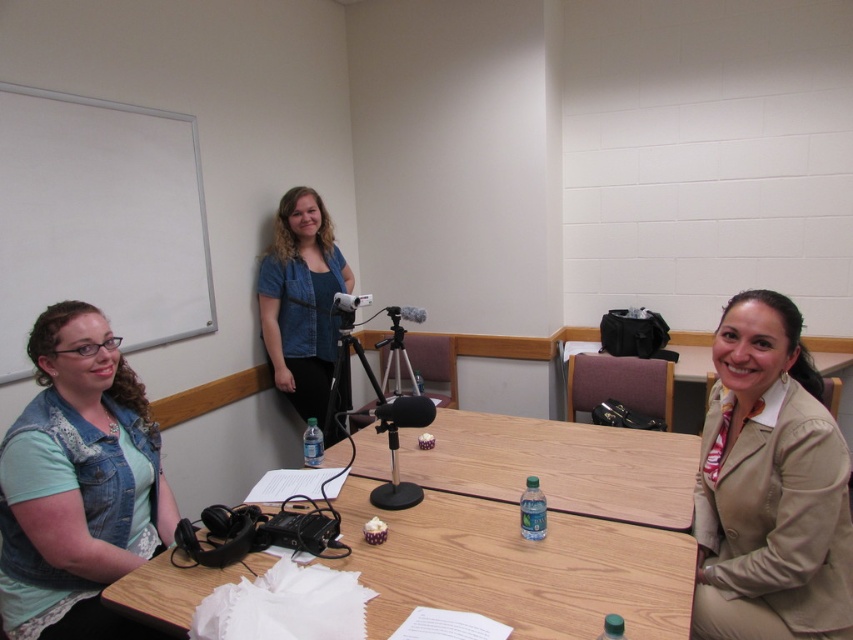
Is wooden table at lower right to the right of black matte tripod at center from the viewer's perspective?

Indeed, wooden table at lower right is positioned on the right side of black matte tripod at center.

Is wooden table at lower right shorter than black matte tripod at center?

Yes, wooden table at lower right is shorter than black matte tripod at center.

Is point (695, 342) more distant than point (343, 355)?

Yes.

Identify the location of wooden table at lower right. (691, 358).

Who is taller, wooden table at center or black matte tripod at center?

black matte tripod at center is taller.

Does wooden table at center have a greater width compared to black matte tripod at center?

Correct, the width of wooden table at center exceeds that of black matte tripod at center.

Does point (480, 461) come in front of point (341, 364)?

That is True.

Image resolution: width=853 pixels, height=640 pixels. What are the coordinates of `wooden table at center` in the screenshot? It's located at (558, 465).

Is the position of white matte whiteboard at upper left less distant than that of wooden table at center?

No, it is not.

Which is below, white matte whiteboard at upper left or wooden table at center?

wooden table at center is below.

What do you see at coordinates (99, 220) in the screenshot?
I see `white matte whiteboard at upper left` at bounding box center [99, 220].

At what (x,y) coordinates should I click in order to perform the action: click on white matte whiteboard at upper left. Please return your answer as a coordinate pair (x, y). The width and height of the screenshot is (853, 640). Looking at the image, I should click on (99, 220).